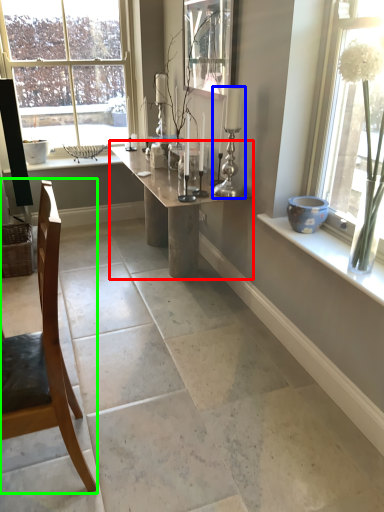
Question: Considering the real-world distances, which object is farthest from table (highlighted by a red box)? candle holder (highlighted by a blue box) or chair (highlighted by a green box)?

Choices:
 (A) candle holder
 (B) chair

Answer: (B)